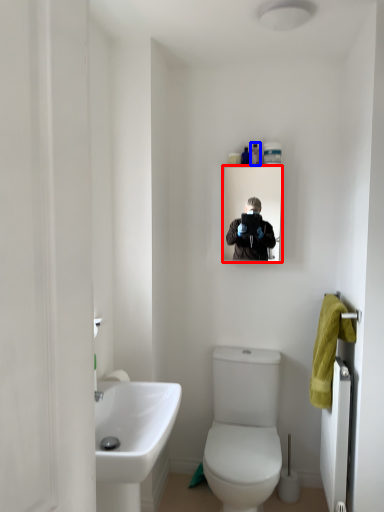
Question: Which object is closer to the camera taking this photo, mirror (highlighted by a red box) or toiletry (highlighted by a blue box)?

Choices:
 (A) mirror
 (B) toiletry

Answer: (A)